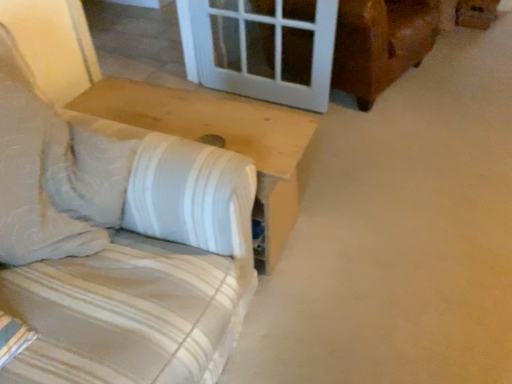
The width and height of the screenshot is (512, 384). Identify the location of blank space above white wood table at lower left (from a real-world perspective). (184, 117).